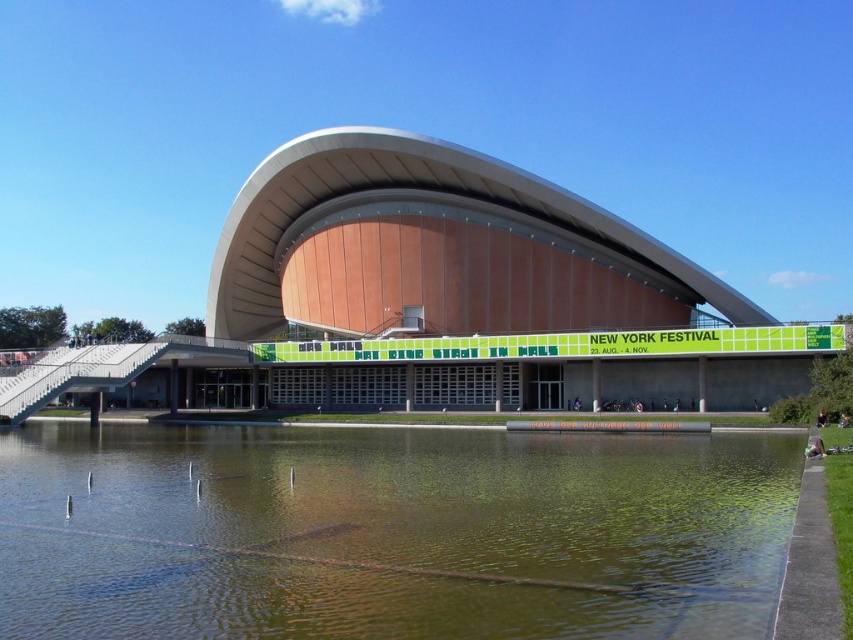
Question: Which of the following is the farthest from the observer?

Choices:
 (A) matte orange building at center
 (B) greenish water at lower center

Answer: (A)

Question: Is greenish water at lower center positioned in front of matte orange building at center?

Choices:
 (A) yes
 (B) no

Answer: (A)

Question: Which point is farther to the camera?

Choices:
 (A) matte orange building at center
 (B) greenish water at lower center

Answer: (A)

Question: Which of the following is the farthest from the observer?

Choices:
 (A) greenish water at lower center
 (B) matte orange building at center

Answer: (B)

Question: Is greenish water at lower center closer to camera compared to matte orange building at center?

Choices:
 (A) no
 (B) yes

Answer: (B)

Question: Is greenish water at lower center positioned in front of matte orange building at center?

Choices:
 (A) yes
 (B) no

Answer: (A)